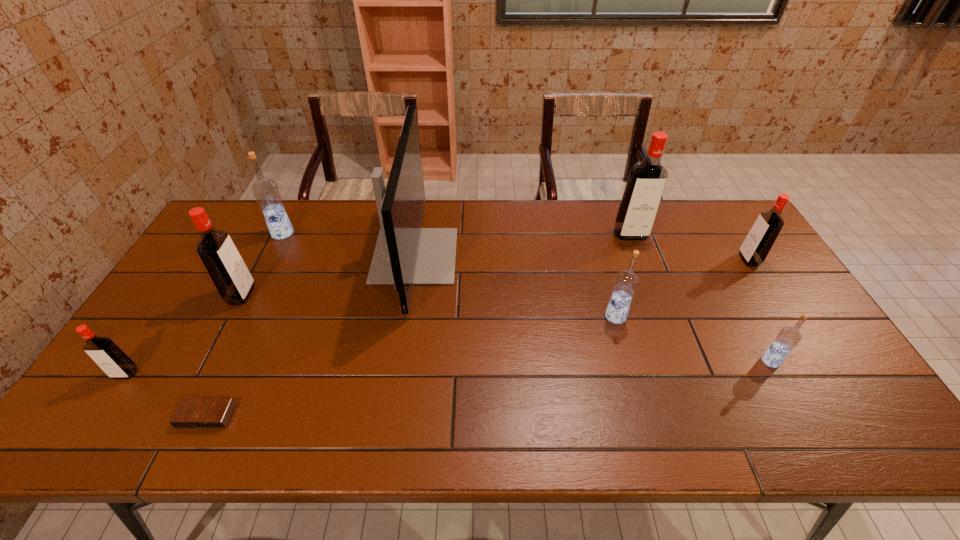
The height and width of the screenshot is (540, 960). Find the location of `vacant region between the nearest object and the second vodka from right to left`. vacant region between the nearest object and the second vodka from right to left is located at coordinates [489, 389].

The width and height of the screenshot is (960, 540). In order to click on vacant space that's between the tallest vodka and the second smallest red vodka in this screenshot , I will do click(689, 247).

Point out which object is positioned as the fifth nearest to the third smallest red vodka. Please provide its 2D coordinates. Your answer should be formatted as a tuple, i.e. [(x, y)], where the tuple contains the x and y coordinates of a point satisfying the conditions above.

[(626, 282)]

The height and width of the screenshot is (540, 960). I want to click on the eighth closest object to the shortest object, so click(x=756, y=246).

Identify which vodka is the second nearest to the second blue vodka from right to left. Please provide its 2D coordinates. Your answer should be formatted as a tuple, i.e. [(x, y)], where the tuple contains the x and y coordinates of a point satisfying the conditions above.

[(788, 337)]

Choose which vodka is the sixth nearest neighbor to the tallest vodka. Please provide its 2D coordinates. Your answer should be formatted as a tuple, i.e. [(x, y)], where the tuple contains the x and y coordinates of a point satisfying the conditions above.

[(105, 353)]

Select which red vodka is the third closest to the black alarm clock. Please provide its 2D coordinates. Your answer should be formatted as a tuple, i.e. [(x, y)], where the tuple contains the x and y coordinates of a point satisfying the conditions above.

[(647, 179)]

Identify which red vodka is located as the third nearest to the rightmost object. Please provide its 2D coordinates. Your answer should be formatted as a tuple, i.e. [(x, y)], where the tuple contains the x and y coordinates of a point satisfying the conditions above.

[(105, 353)]

The width and height of the screenshot is (960, 540). Find the location of `blue vodka that is the third closest to the third vodka from right to left`. blue vodka that is the third closest to the third vodka from right to left is located at coordinates (266, 192).

Find the location of `blue vodka that is the second closest to the third red vodka from left to right`. blue vodka that is the second closest to the third red vodka from left to right is located at coordinates (788, 337).